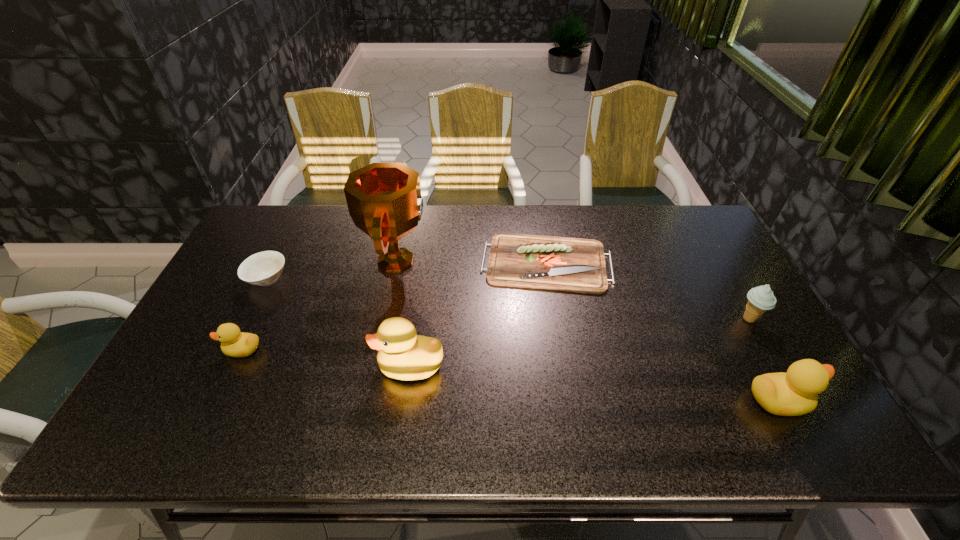
Please point a location where one more duckling can be added evenly. Please provide its 2D coordinates. Your answer should be formatted as a tuple, i.e. [(x, y)], where the tuple contains the x and y coordinates of a point satisfying the conditions above.

[(588, 383)]